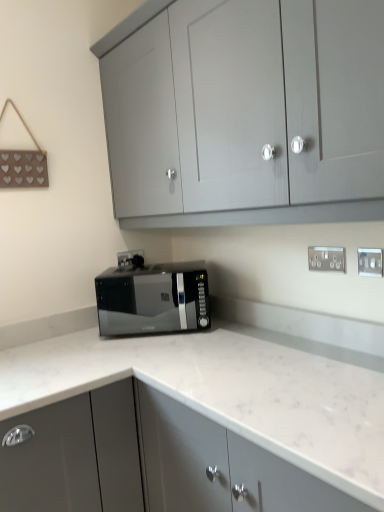
Question: Do you think white plastic electric outlet at upper right, the 1th electric outlet viewed from the front, is within silver metallic electric outlet at center-right, which ranks as the 3th electric outlet in right-to-left order, or outside of it?

Choices:
 (A) outside
 (B) inside

Answer: (A)

Question: In terms of width, does white plastic electric outlet at upper right, the first electric outlet in the right-to-left sequence, look wider or thinner when compared to silver metallic electric outlet at center-right, which ranks as the 3th electric outlet in right-to-left order?

Choices:
 (A) thin
 (B) wide

Answer: (B)

Question: Which object is positioned farthest from the silver metallic electric outlet at upper right, acting as the second electric outlet starting from the front?

Choices:
 (A) white plastic electric outlet at upper right, the 1th electric outlet viewed from the front
 (B) matte gray cabinet at upper center, which ranks as the 1th cabinetry in top-to-bottom order
 (C) black glossy microwave at center
 (D) white marble countertop at center, the 1th cabinetry from the bottom
 (E) silver metallic electric outlet at center-right, the 1th electric outlet when ordered from back to front

Answer: (E)

Question: Which of these objects is positioned farthest from the matte gray cabinet at upper center, the second cabinetry ordered from the bottom?

Choices:
 (A) white plastic electric outlet at upper right, the 1th electric outlet viewed from the front
 (B) white marble countertop at center, acting as the 2th cabinetry starting from the top
 (C) silver metallic electric outlet at center-right, which appears as the third electric outlet when viewed from the front
 (D) silver metallic electric outlet at upper right, the 2th electric outlet positioned from the left
 (E) black glossy microwave at center

Answer: (C)